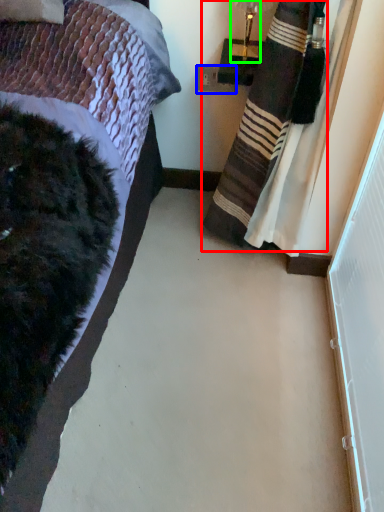
Question: Which object is the closest to the curtain (highlighted by a red box)? Choose among these: power outlet (highlighted by a blue box) or lamp (highlighted by a green box).

Choices:
 (A) power outlet
 (B) lamp

Answer: (B)